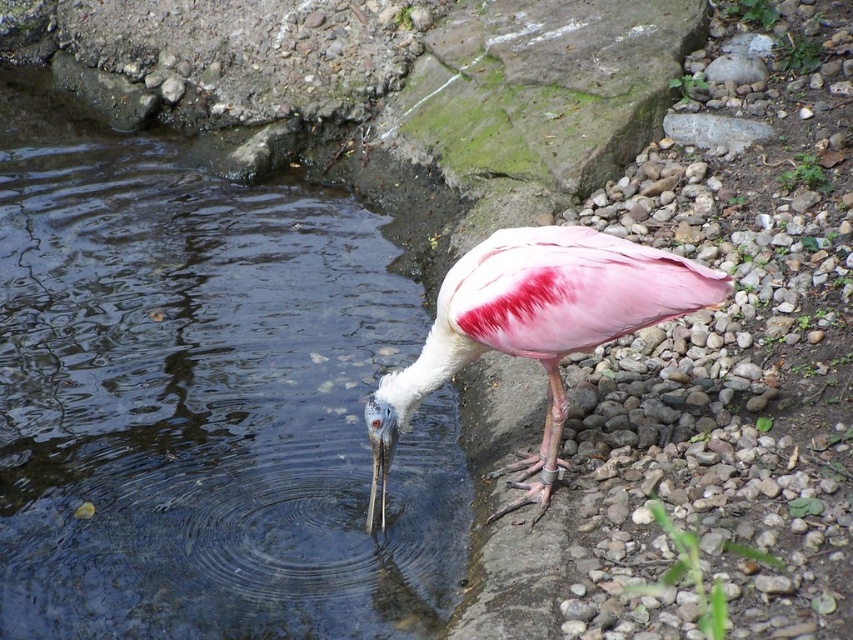
Between clear water at center and pink feathered bird at center, which one has less height?

With less height is pink feathered bird at center.

Does clear water at center lie in front of pink feathered bird at center?

No, clear water at center is behind pink feathered bird at center.

Find the location of a particular element. The height and width of the screenshot is (640, 853). clear water at center is located at coordinates click(202, 401).